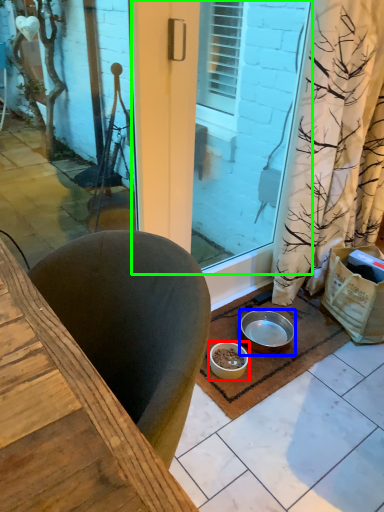
Question: Which object is positioned closest to bowl (highlighted by a red box)? Select from bowl (highlighted by a blue box) and screen door (highlighted by a green box).

Choices:
 (A) bowl
 (B) screen door

Answer: (A)